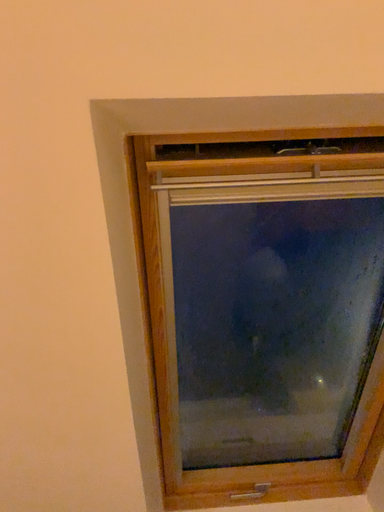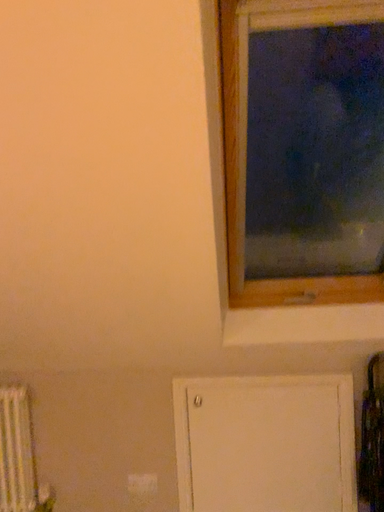
Question: Which way did the camera rotate in the video?

Choices:
 (A) rotated upward
 (B) rotated downward

Answer: (B)